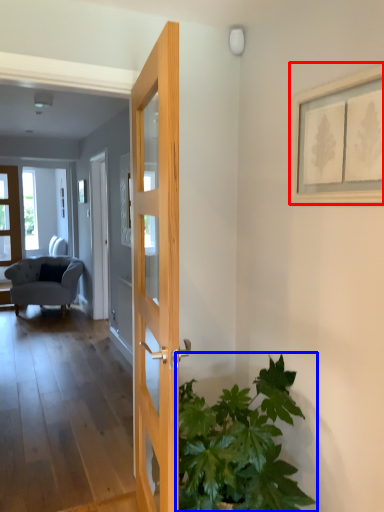
Question: Which point is closer to the camera, picture frame (highlighted by a red box) or houseplant (highlighted by a blue box)?

Choices:
 (A) picture frame
 (B) houseplant

Answer: (B)